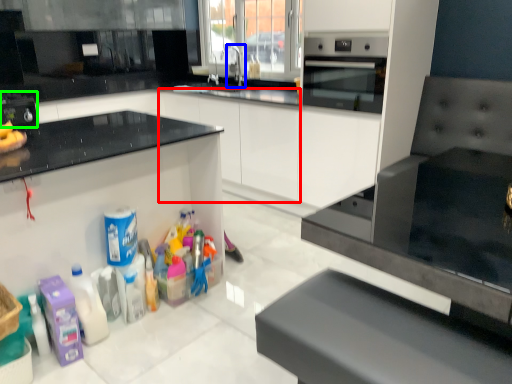
Question: Based on their relative distances, which object is farther from cabinetry (highlighted by a red box)? Choose from faucet (highlighted by a blue box) and appliance (highlighted by a green box).

Choices:
 (A) faucet
 (B) appliance

Answer: (B)